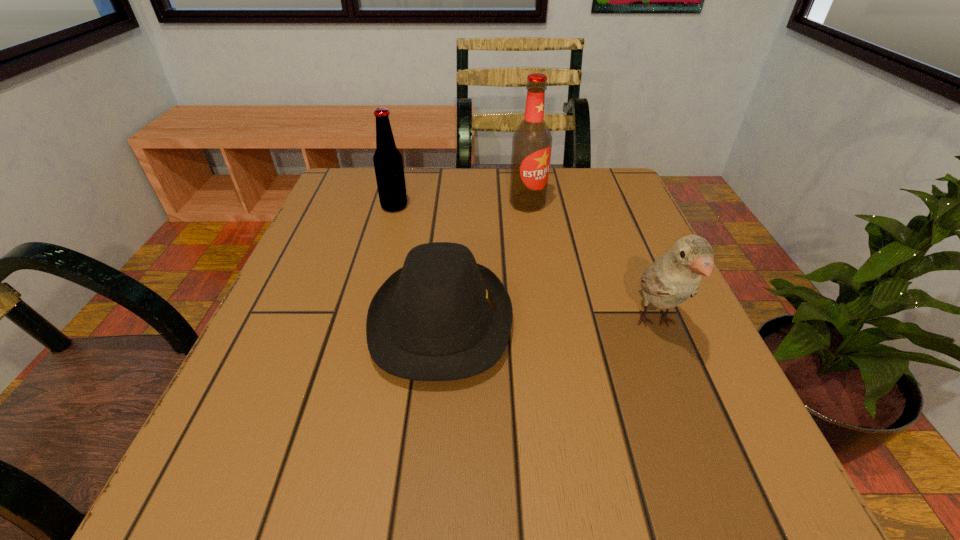
Locate an element on the screen. vacant area in the image that satisfies the following two spatial constraints: 1. on the back side of the shorter beer bottle; 2. on the right side of the right beer bottle is located at coordinates (396, 204).